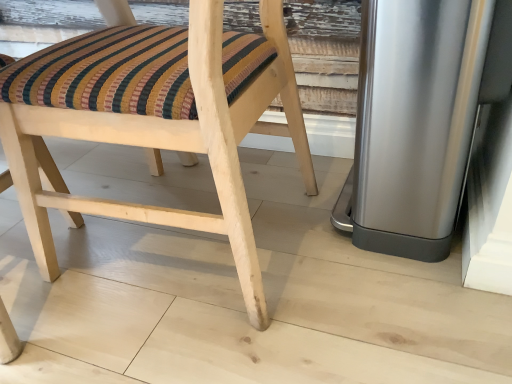
Question: From the image's perspective, is polished stainless steel trash can at right positioned above or below natural wood chair at center?

Choices:
 (A) above
 (B) below

Answer: (A)

Question: Looking at their shapes, would you say polished stainless steel trash can at right is wider or thinner than natural wood chair at center?

Choices:
 (A) wide
 (B) thin

Answer: (B)

Question: Choose the correct answer: Is polished stainless steel trash can at right inside natural wood chair at center or outside it?

Choices:
 (A) outside
 (B) inside

Answer: (A)

Question: Is point (4, 71) closer or farther from the camera than point (452, 51)?

Choices:
 (A) closer
 (B) farther

Answer: (B)

Question: In the image, is natural wood chair at center positioned in front of or behind polished stainless steel trash can at right?

Choices:
 (A) front
 (B) behind

Answer: (A)

Question: In terms of width, does natural wood chair at center look wider or thinner when compared to polished stainless steel trash can at right?

Choices:
 (A) thin
 (B) wide

Answer: (B)

Question: In terms of height, does natural wood chair at center look taller or shorter compared to polished stainless steel trash can at right?

Choices:
 (A) tall
 (B) short

Answer: (A)